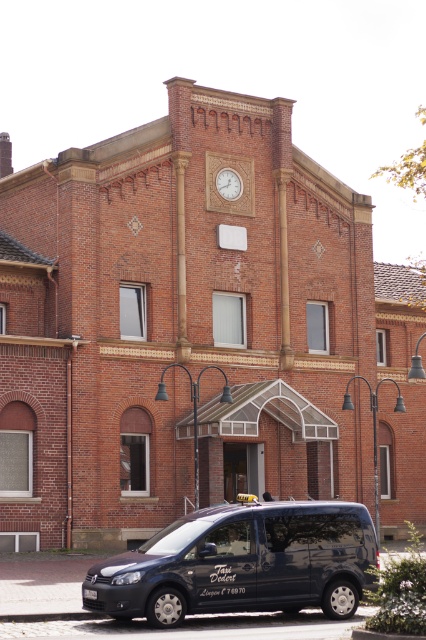
Question: Which point is closer to the camera taking this photo?

Choices:
 (A) (233, 176)
 (B) (181, 561)

Answer: (B)

Question: Which point is farther to the camera?

Choices:
 (A) (238, 186)
 (B) (354, 586)

Answer: (A)

Question: Which of the following is the farthest from the observer?

Choices:
 (A) (x=222, y=172)
 (B) (x=115, y=577)

Answer: (A)

Question: Can you confirm if matte black van at lower center is positioned to the left of wooden clock at upper center?

Choices:
 (A) yes
 (B) no

Answer: (A)

Question: Is matte black van at lower center to the right of wooden clock at upper center from the viewer's perspective?

Choices:
 (A) yes
 (B) no

Answer: (B)

Question: Can you confirm if matte black van at lower center is smaller than wooden clock at upper center?

Choices:
 (A) yes
 (B) no

Answer: (B)